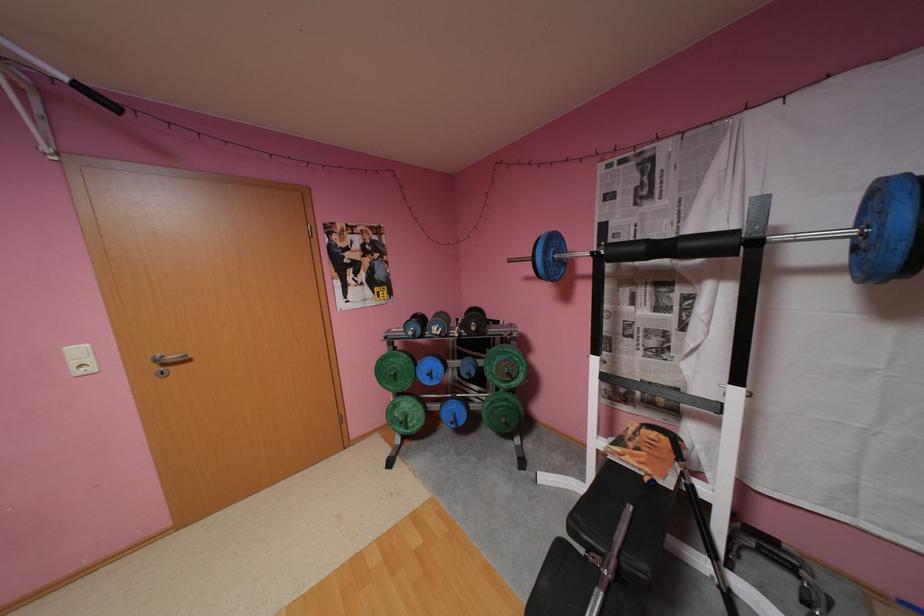
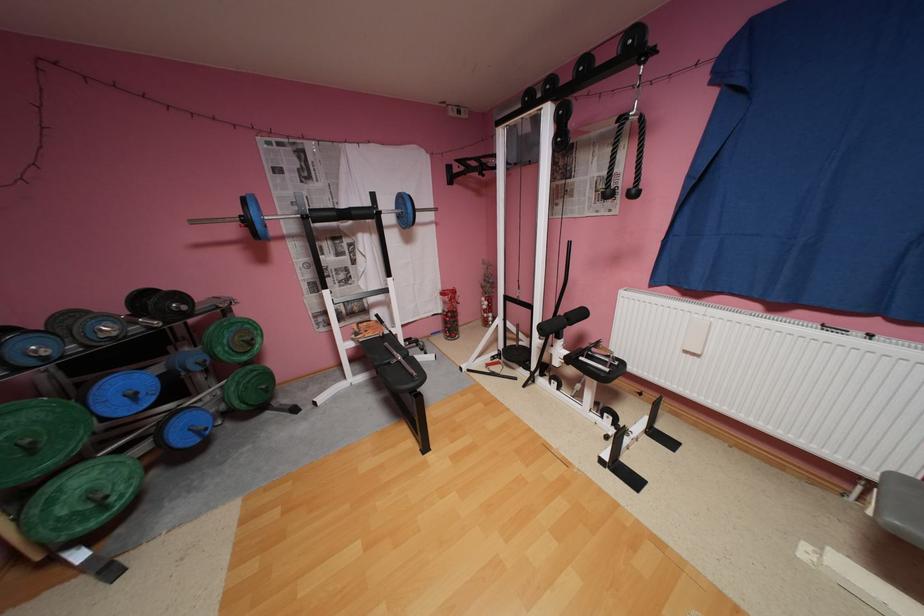
Where in the second image is the point corresponding to (640,461) from the first image?

(380, 334)